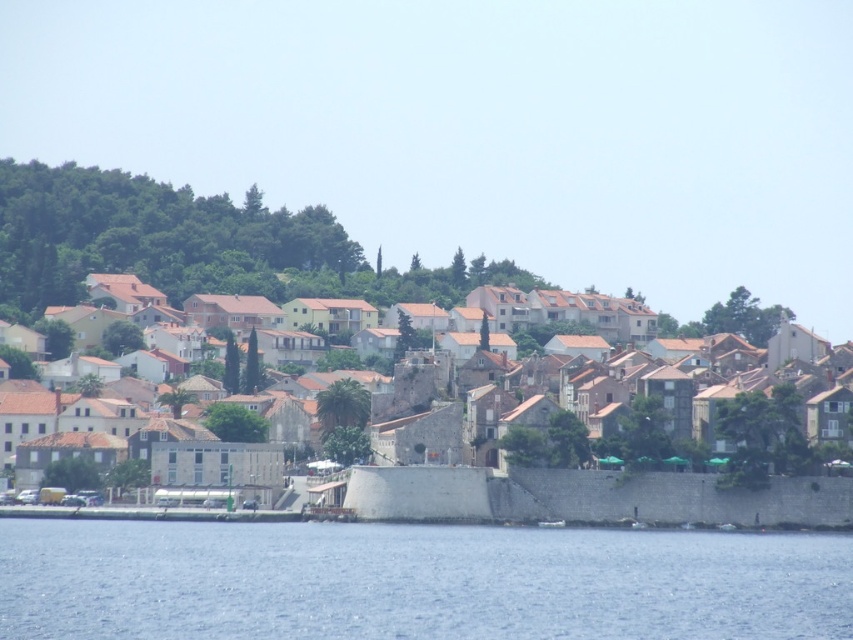
Question: Which point is closer to the camera?

Choices:
 (A) blue water at lower center
 (B) brown stone town at center

Answer: (A)

Question: Which of the following is the farthest from the observer?

Choices:
 (A) (225, 557)
 (B) (762, 416)

Answer: (B)

Question: Observing the image, what is the correct spatial positioning of blue water at lower center in reference to brown stone town at center?

Choices:
 (A) above
 (B) below

Answer: (B)

Question: Does blue water at lower center appear under brown stone town at center?

Choices:
 (A) no
 (B) yes

Answer: (B)

Question: Which of the following is the closest to the observer?

Choices:
 (A) (573, 620)
 (B) (653, 372)

Answer: (A)

Question: Can you confirm if blue water at lower center is thinner than brown stone town at center?

Choices:
 (A) yes
 (B) no

Answer: (A)